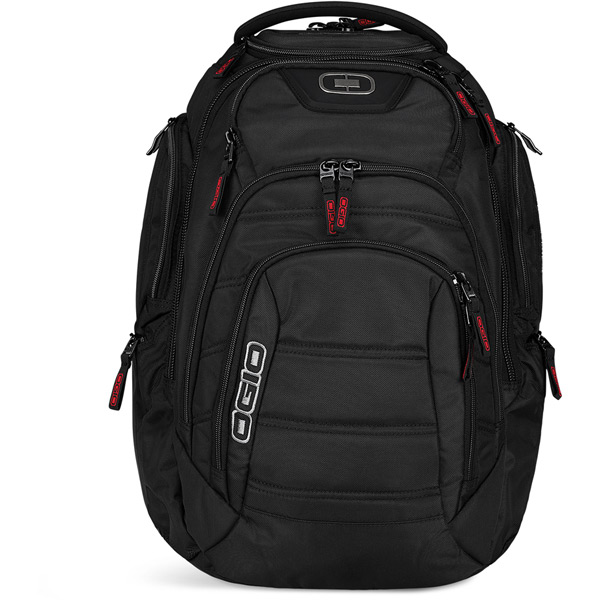
Identify the location of top compartment. The width and height of the screenshot is (600, 600). (371, 50).